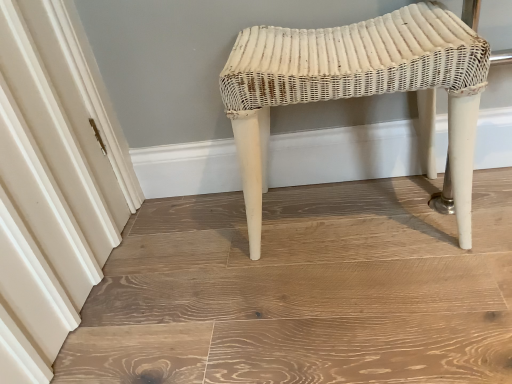
Find the location of a particular element. The width and height of the screenshot is (512, 384). free space in front of white wicker stool at center is located at coordinates (373, 307).